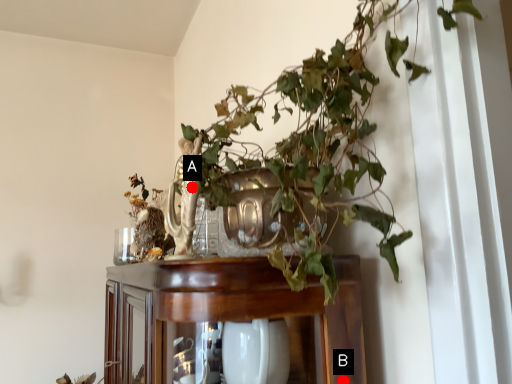
Question: Two points are circled on the image, labeled by A and B beside each circle. Which point is farther to the camera?

Choices:
 (A) A is further
 (B) B is further

Answer: (A)